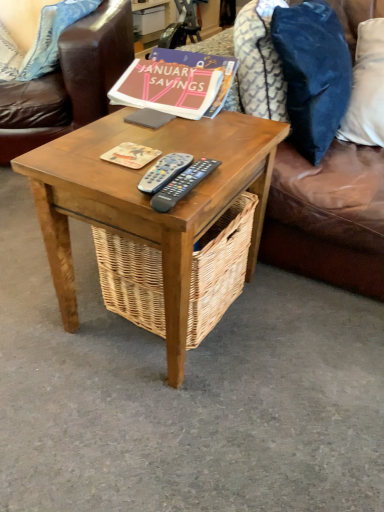
Image resolution: width=384 pixels, height=512 pixels. What are the coordinates of `free location to the left of woven wood picnic basket at center` in the screenshot? It's located at (56, 310).